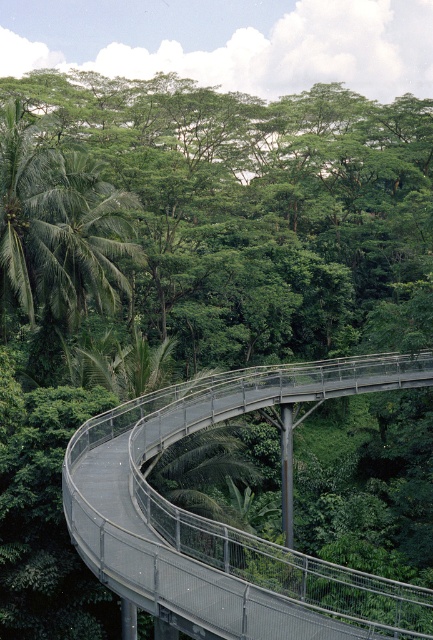
Can you confirm if metallic gray pedestrian bridge at center is taller than green leafy palm at left?

In fact, metallic gray pedestrian bridge at center may be shorter than green leafy palm at left.

Which of these two, metallic gray pedestrian bridge at center or green leafy palm at left, stands taller?

green leafy palm at left is taller.

Is point (241, 404) positioned behind point (57, 147)?

No, (241, 404) is in front of (57, 147).

Identify the location of metallic gray pedestrian bridge at center. The width and height of the screenshot is (433, 640). (225, 524).